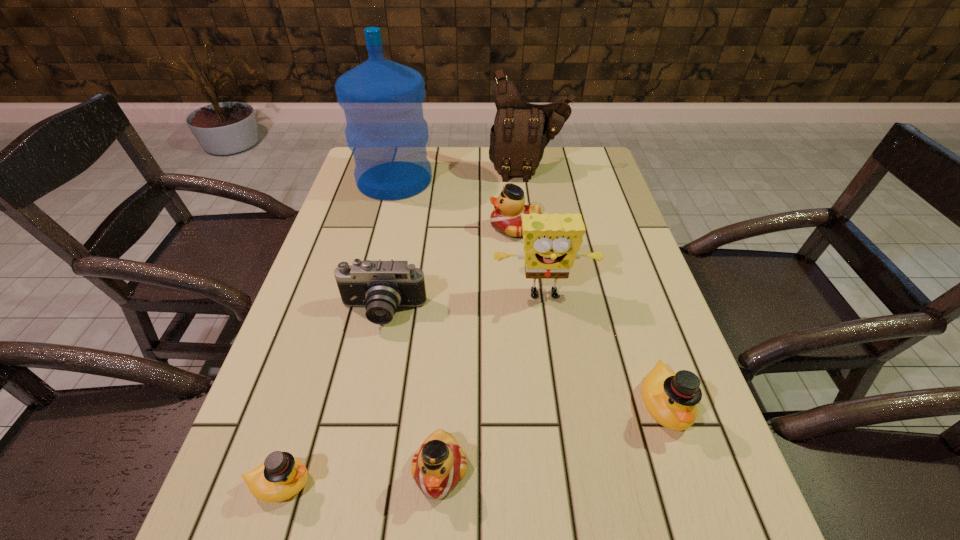
At what (x,y) coordinates should I click in order to perform the action: click on empty location between the rightmost object and the black camera. Please return your answer as a coordinate pair (x, y). The width and height of the screenshot is (960, 540). Looking at the image, I should click on (524, 359).

Locate an element on the screen. This screenshot has width=960, height=540. empty space between the nearer yellow duck and the rightmost object is located at coordinates (472, 444).

The image size is (960, 540). I want to click on unoccupied area between the bigger red duck and the smaller red duck, so click(477, 349).

Locate an element on the screen. This screenshot has height=540, width=960. vacant area that lies between the brown shoulder bag and the blue water jug is located at coordinates (462, 175).

At what (x,y) coordinates should I click in order to perform the action: click on blank region between the brown shoulder bag and the smaller red duck. Please return your answer as a coordinate pair (x, y). The width and height of the screenshot is (960, 540). Looking at the image, I should click on pyautogui.click(x=484, y=320).

Locate an element on the screen. The height and width of the screenshot is (540, 960). vacant space that is in between the right red duck and the black camera is located at coordinates (449, 270).

Select which object appears as the second closest to the left red duck. Please provide its 2D coordinates. Your answer should be formatted as a tuple, i.e. [(x, y)], where the tuple contains the x and y coordinates of a point satisfying the conditions above.

[(381, 287)]

Find the location of a particular element. This screenshot has height=540, width=960. object identified as the second closest to the right yellow duck is located at coordinates (439, 464).

Where is `duck that can be found as the fourth closest to the water jug`? This screenshot has width=960, height=540. duck that can be found as the fourth closest to the water jug is located at coordinates (281, 476).

Where is `duck that can be found as the third closest to the smaller yellow duck`? Image resolution: width=960 pixels, height=540 pixels. duck that can be found as the third closest to the smaller yellow duck is located at coordinates (506, 218).